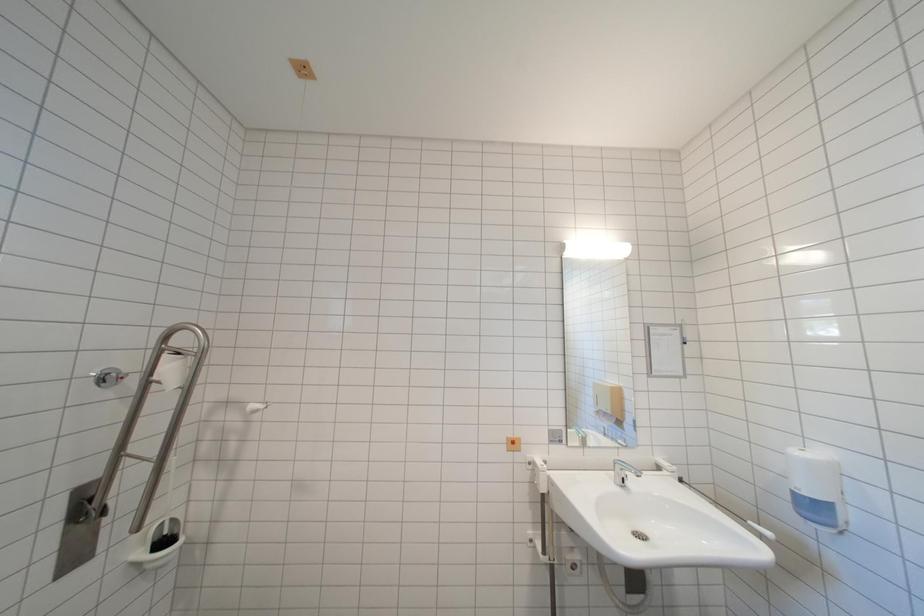
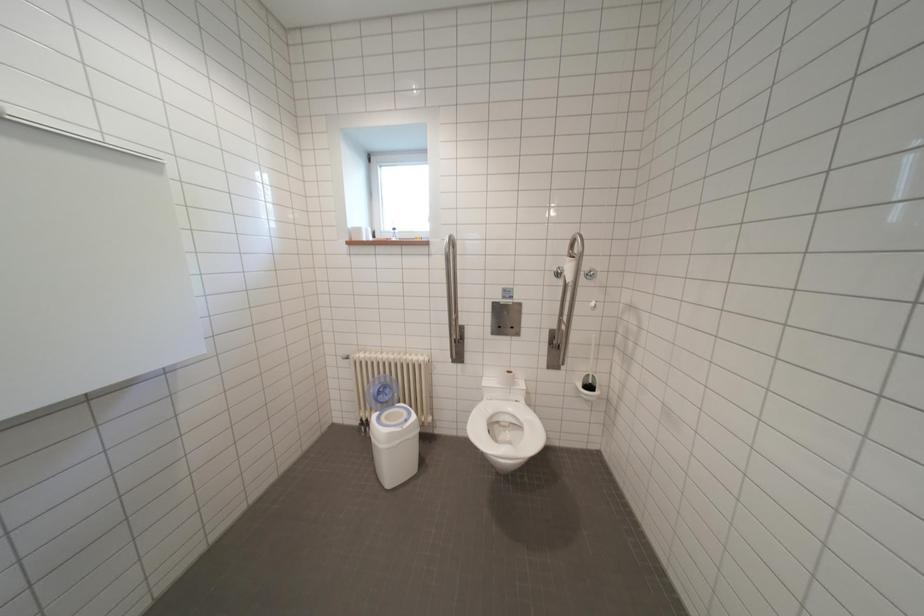
Question: The camera is either moving clockwise (left) or counter-clockwise (right) around the object. The first image is from the beginning of the video and the second image is from the end. Is the camera moving left or right when shooting the video?

Choices:
 (A) Left
 (B) Right

Answer: (B)